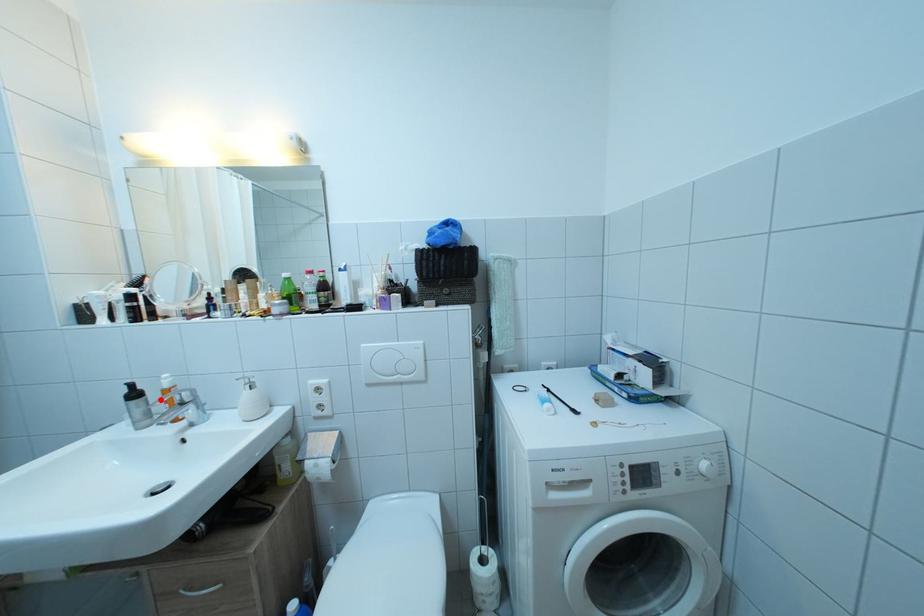
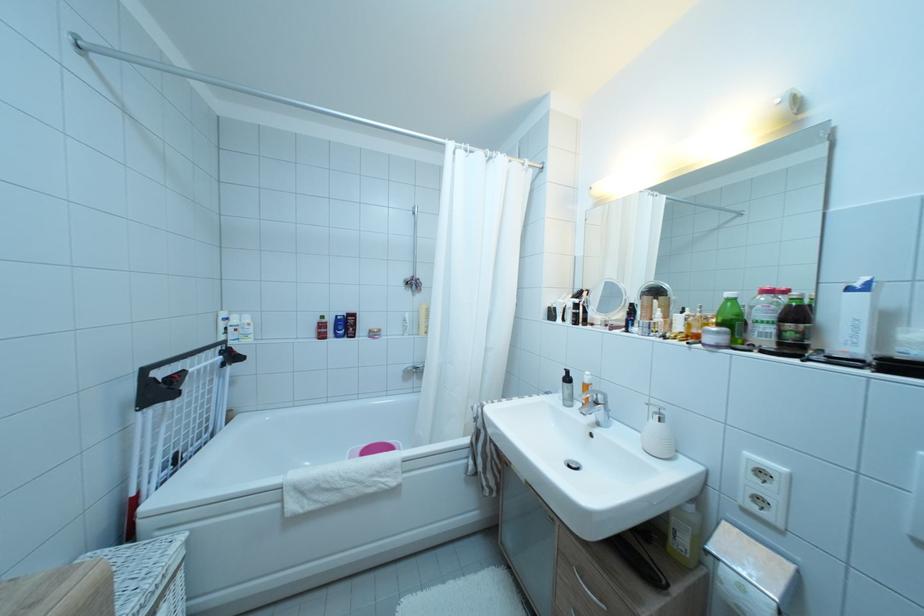
The point at the highlighted location is marked in the first image. Where is the corresponding point in the second image?

(585, 390)